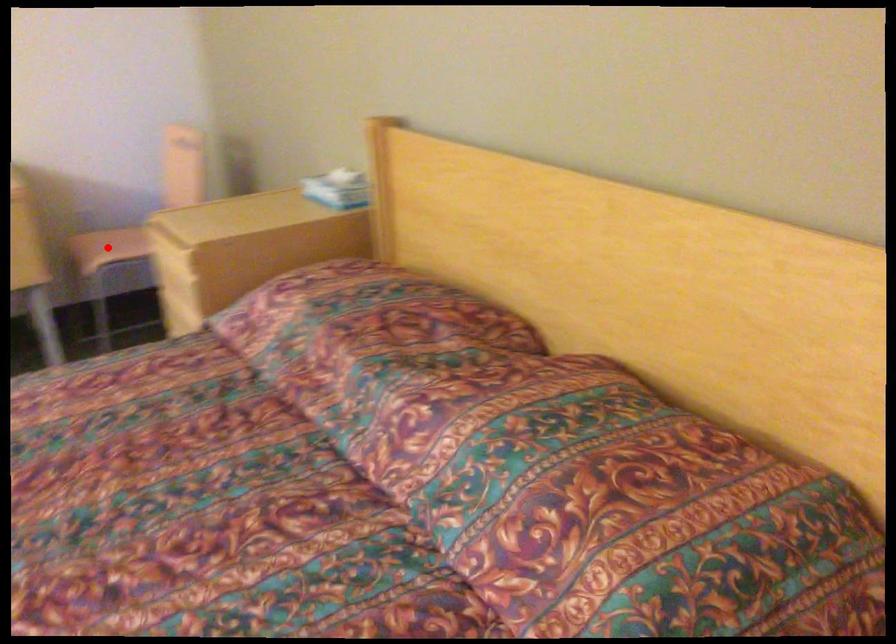
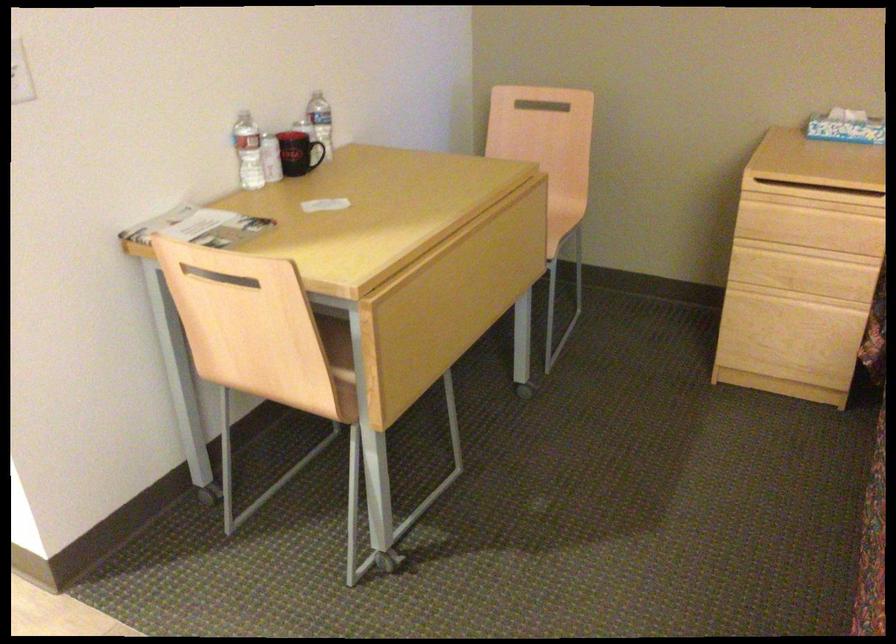
Question: I am providing you with two images of the same scene from different viewpoints. A red point is marked on the first image. Can you still see the location of the red point in image 2?

Choices:
 (A) Yes
 (B) No

Answer: (B)